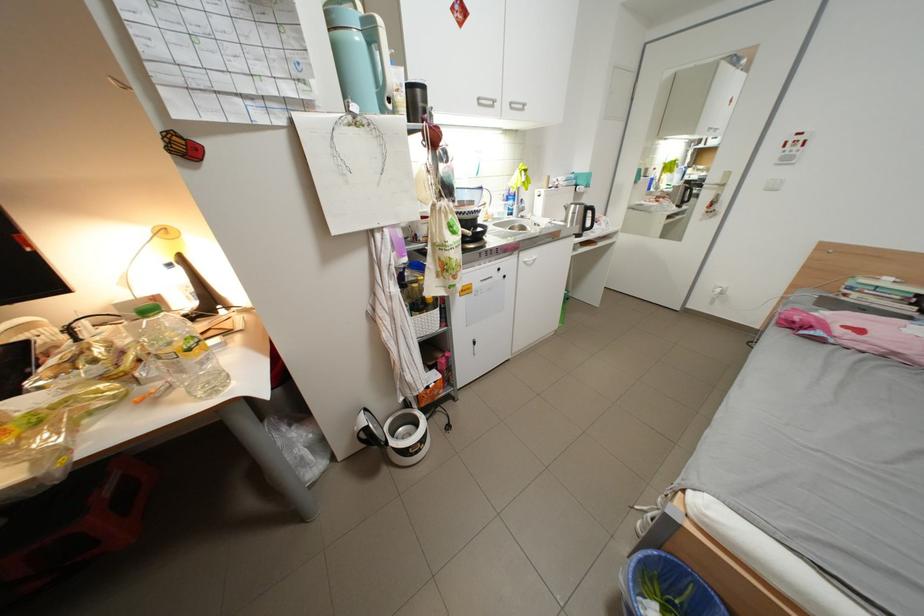
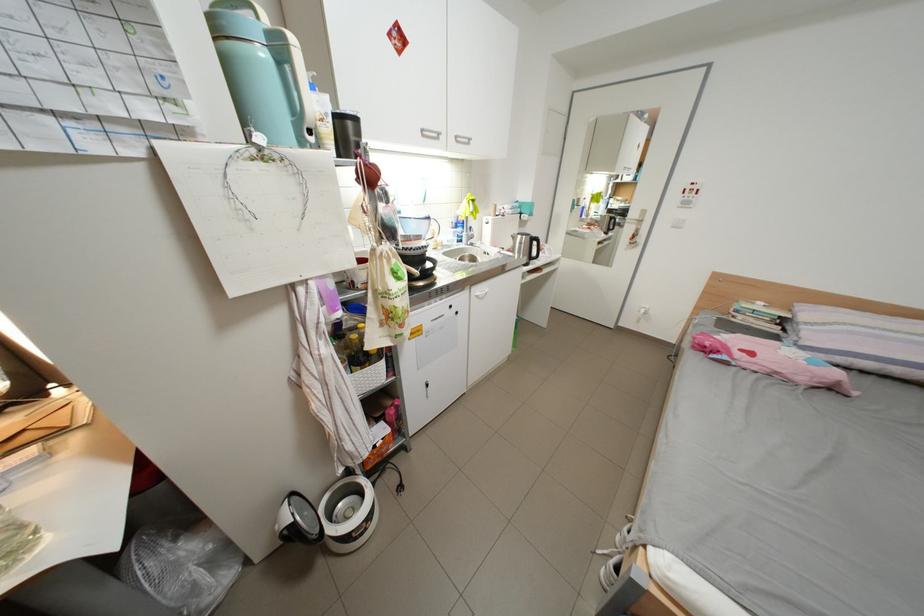
Question: In a continuous first-person perspective shot, in which direction is the camera moving?

Choices:
 (A) Left
 (B) Right
 (C) Forward
 (D) Backward

Answer: (C)